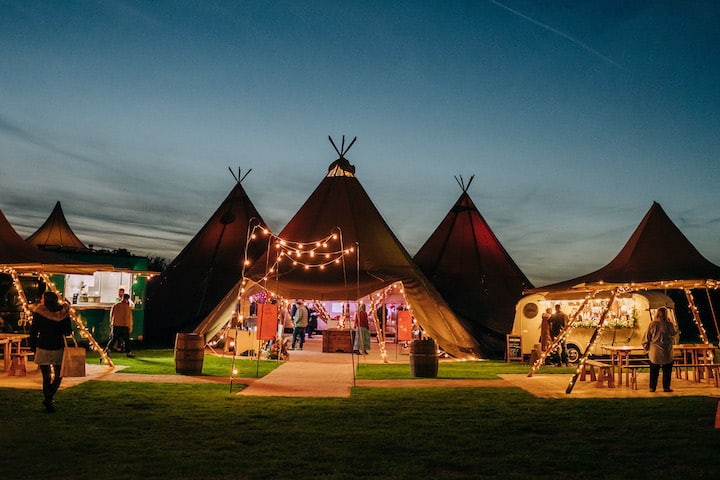
Locate an element on the screen. lights is located at coordinates (322, 238).